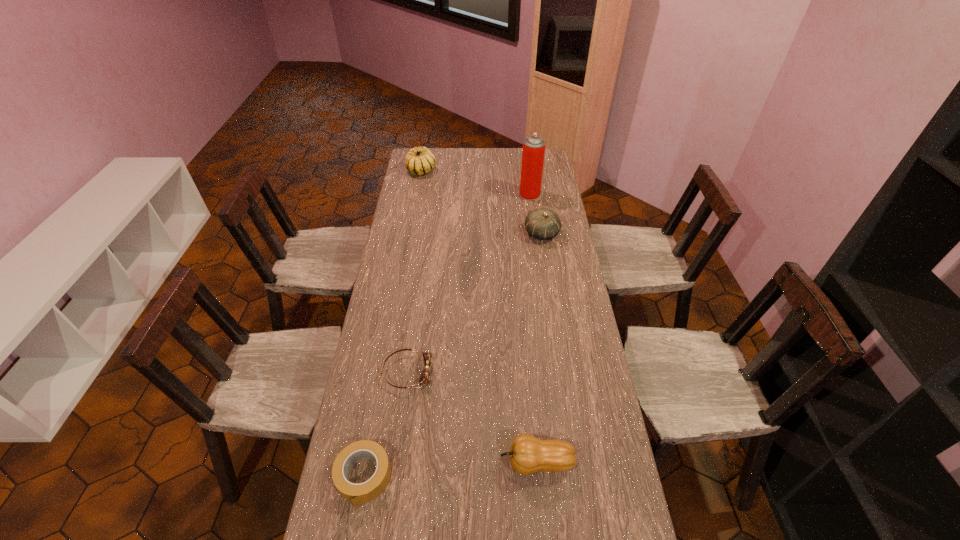
Locate an element on the screen. vacant space located on the left of the fourth nearest object is located at coordinates (456, 234).

Image resolution: width=960 pixels, height=540 pixels. What are the coordinates of `vacant space located on the stem side of the nearest gourd` in the screenshot? It's located at (461, 463).

Locate an element on the screen. The height and width of the screenshot is (540, 960). free spot located 0.210m on the stem side of the nearest gourd is located at coordinates pos(425,463).

What are the coordinates of `vacant area located on the stem side of the nearest gourd` in the screenshot? It's located at (454, 463).

Where is `blank area located at the edge of the duct tape`? blank area located at the edge of the duct tape is located at coordinates (353, 534).

Find the location of `vacant position located through the lenses of the third nearest object`. vacant position located through the lenses of the third nearest object is located at coordinates (543, 372).

Locate an element on the screen. This screenshot has height=540, width=960. object situated at the far edge is located at coordinates (419, 160).

Identify the location of gourd that is at the left edge. This screenshot has width=960, height=540. (419, 160).

Where is `duct tape situated at the left edge`? The width and height of the screenshot is (960, 540). duct tape situated at the left edge is located at coordinates (364, 492).

Image resolution: width=960 pixels, height=540 pixels. I want to click on goggles that is at the left edge, so click(x=425, y=375).